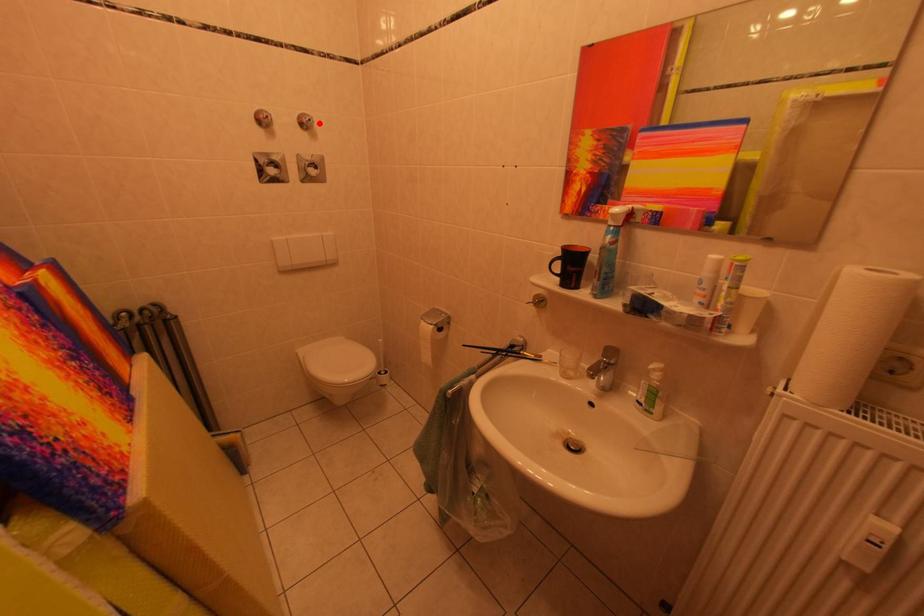
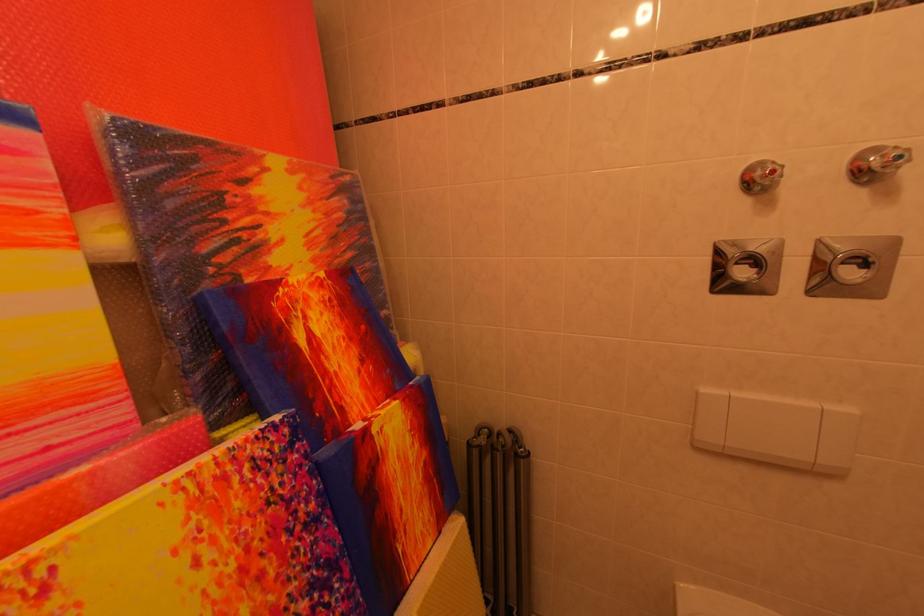
Question: I am providing you with two images of the same scene from different viewpoints. A red point is shown in image1. For the corresponding object point in image2, is it positioned nearer or farther from the camera?

Choices:
 (A) Nearer
 (B) Farther

Answer: (B)